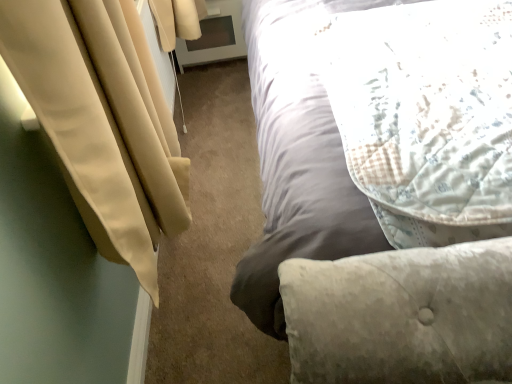
The height and width of the screenshot is (384, 512). What do you see at coordinates (352, 240) in the screenshot?
I see `light gray fabric bed at upper right` at bounding box center [352, 240].

Find the location of a particular element. The image size is (512, 384). beige fabric curtain at left is located at coordinates (102, 121).

What do you see at coordinates (102, 121) in the screenshot?
I see `beige fabric curtain at left` at bounding box center [102, 121].

Locate an element on the screen. Image resolution: width=512 pixels, height=384 pixels. light gray fabric bed at upper right is located at coordinates (352, 240).

Considering the relative positions of fluffy white pillow at upper right and light gray fabric bed at upper right in the image provided, is fluffy white pillow at upper right to the right of light gray fabric bed at upper right from the viewer's perspective?

Incorrect, fluffy white pillow at upper right is not on the right side of light gray fabric bed at upper right.

Is fluffy white pillow at upper right wider or thinner than light gray fabric bed at upper right?

Considering their sizes, fluffy white pillow at upper right looks slimmer than light gray fabric bed at upper right.

Is fluffy white pillow at upper right not inside light gray fabric bed at upper right?

Actually, fluffy white pillow at upper right is at least partially inside light gray fabric bed at upper right.

This screenshot has height=384, width=512. Identify the location of curtain located in front of the fluffy white pillow at upper right. (102, 121).

From the image's perspective, is beige fabric curtain at left positioned above or below fluffy white pillow at upper right?

From the image's perspective, beige fabric curtain at left appears below fluffy white pillow at upper right.

Can you confirm if beige fabric curtain at left is shorter than fluffy white pillow at upper right?

Incorrect, the height of beige fabric curtain at left does not fall short of that of fluffy white pillow at upper right.

Which object is closer to the camera, beige fabric curtain at left or fluffy white pillow at upper right?

beige fabric curtain at left.

From the picture: Is fluffy white pillow at upper right looking in the opposite direction of beige fabric curtain at left?

fluffy white pillow at upper right is not turned away from beige fabric curtain at left.

Considering the sizes of fluffy white pillow at upper right and beige fabric curtain at left in the image, is fluffy white pillow at upper right wider or thinner than beige fabric curtain at left?

Clearly, fluffy white pillow at upper right has more width compared to beige fabric curtain at left.

Considering the relative positions of fluffy white pillow at upper right and beige fabric curtain at left in the image provided, is fluffy white pillow at upper right in front of beige fabric curtain at left?

No, fluffy white pillow at upper right is behind beige fabric curtain at left.

Looking at this image, considering the relative sizes of fluffy white pillow at upper right and beige fabric curtain at left in the image provided, is fluffy white pillow at upper right smaller than beige fabric curtain at left?

No.

How many degrees apart are the facing directions of light gray fabric bed at upper right and beige fabric curtain at left?

light gray fabric bed at upper right and beige fabric curtain at left are facing 91.1 degrees away from each other.

Is light gray fabric bed at upper right not close to beige fabric curtain at left?

No, light gray fabric bed at upper right is not far from beige fabric curtain at left.

From a real-world perspective, relative to beige fabric curtain at left, is light gray fabric bed at upper right vertically above or below?

light gray fabric bed at upper right is situated lower than beige fabric curtain at left in the real world.

Identify the location of bed that appears on the right of beige fabric curtain at left. The height and width of the screenshot is (384, 512). (352, 240).

From the picture: Can we say beige fabric curtain at left lies outside light gray fabric bed at upper right?

That's correct, beige fabric curtain at left is outside of light gray fabric bed at upper right.

How much distance is there between beige fabric curtain at left and light gray fabric bed at upper right?

beige fabric curtain at left is 14.36 inches away from light gray fabric bed at upper right.

Can you tell me how much beige fabric curtain at left and light gray fabric bed at upper right differ in facing direction?

There is a 91.1-degree angle between the facing directions of beige fabric curtain at left and light gray fabric bed at upper right.

From the image's perspective, between beige fabric curtain at left and light gray fabric bed at upper right, which one is located above?

light gray fabric bed at upper right, from the image's perspective.

Looking at the image, does light gray fabric bed at upper right seem bigger or smaller compared to fluffy white pillow at upper right?

Considering their sizes, light gray fabric bed at upper right takes up more space than fluffy white pillow at upper right.

Does light gray fabric bed at upper right touch fluffy white pillow at upper right?

They are not placed beside each other.

Does point (300, 68) lie behind point (416, 230)?

Yes, it is.

This screenshot has width=512, height=384. Find the location of `bed lying in front of the fluffy white pillow at upper right`. bed lying in front of the fluffy white pillow at upper right is located at coordinates (352, 240).

This screenshot has width=512, height=384. What are the coordinates of `curtain below the fluffy white pillow at upper right (from the image's perspective)` in the screenshot? It's located at (102, 121).

From the image, which object appears to be farther from light gray fabric bed at upper right, fluffy white pillow at upper right or beige fabric curtain at left?

Among the two, beige fabric curtain at left is located further to light gray fabric bed at upper right.

From the image, which object appears to be farther from beige fabric curtain at left, light gray fabric bed at upper right or fluffy white pillow at upper right?

fluffy white pillow at upper right is further to beige fabric curtain at left.

From the image, which object appears to be nearer to light gray fabric bed at upper right, beige fabric curtain at left or fluffy white pillow at upper right?

fluffy white pillow at upper right is positioned closer to the anchor light gray fabric bed at upper right.

Looking at the image, which one is located further to beige fabric curtain at left, fluffy white pillow at upper right or light gray fabric bed at upper right?

fluffy white pillow at upper right.

Considering their positions, is beige fabric curtain at left positioned further to fluffy white pillow at upper right than light gray fabric bed at upper right?

beige fabric curtain at left is further to fluffy white pillow at upper right.

Which object lies further to the anchor point fluffy white pillow at upper right, light gray fabric bed at upper right or beige fabric curtain at left?

Among the two, beige fabric curtain at left is located further to fluffy white pillow at upper right.

This screenshot has height=384, width=512. What are the coordinates of `pillow between beige fabric curtain at left and light gray fabric bed at upper right` in the screenshot? It's located at (426, 116).